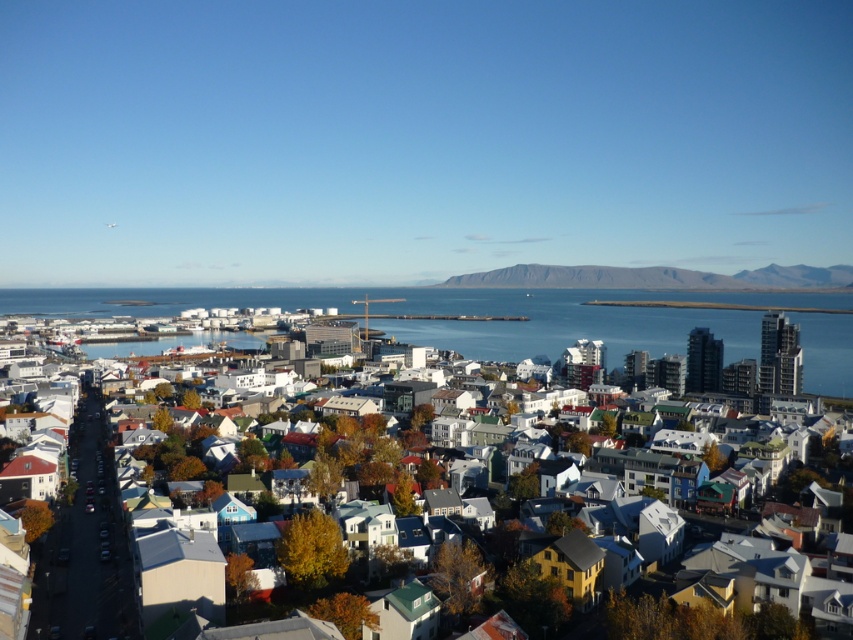
What do you see at coordinates (581, 321) in the screenshot? I see `blue water at center` at bounding box center [581, 321].

Is point (625, 330) less distant than point (537, 282)?

Yes, point (625, 330) is closer to viewer.

Where is `blue water at center`? blue water at center is located at coordinates (581, 321).

What do you see at coordinates (581, 321) in the screenshot? I see `blue water at center` at bounding box center [581, 321].

Does blue water at center have a lesser height compared to white matte buildings at center?

Correct, blue water at center is not as tall as white matte buildings at center.

Is point (734, 300) behind point (125, 312)?

No.

Where is `blue water at center`? blue water at center is located at coordinates (581, 321).

Between white matte buildings at center and rocky gray cliff at center, which one is positioned higher?

rocky gray cliff at center

Image resolution: width=853 pixels, height=640 pixels. What are the coordinates of `white matte buildings at center` in the screenshot? It's located at (582, 323).

Find the location of a particular element. white matte buildings at center is located at coordinates (582, 323).